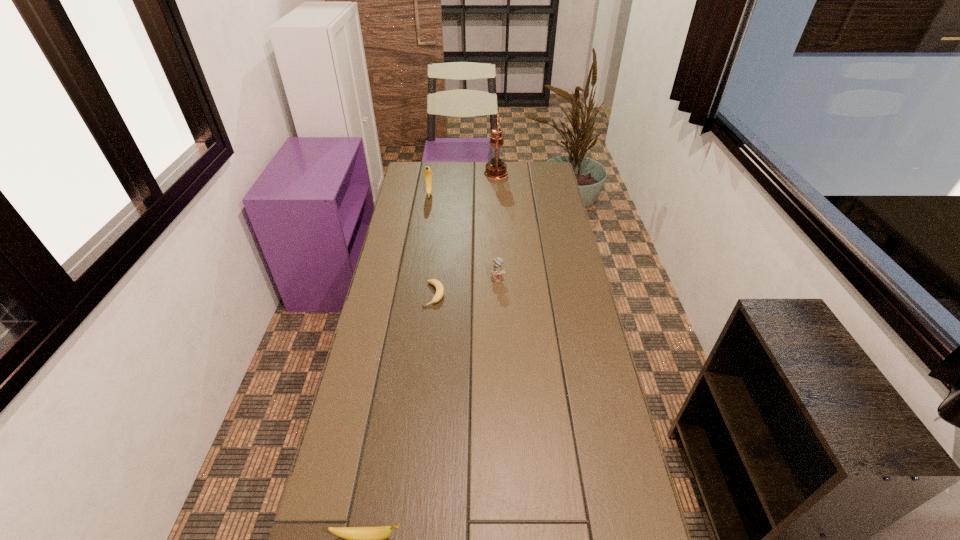
Locate an element on the screen. Image resolution: width=960 pixels, height=540 pixels. vacant area between the oil lamp and the third shortest object is located at coordinates (497, 226).

At what (x,y) coordinates should I click in order to perform the action: click on free point between the oil lamp and the fourth nearest object. Please return your answer as a coordinate pair (x, y). Image resolution: width=960 pixels, height=540 pixels. Looking at the image, I should click on (463, 184).

Find the location of a particular element. object that stands as the closest to the teddy bear is located at coordinates (437, 284).

Find the location of a particular element. object that is the third closest one to the second tallest banana is located at coordinates (427, 172).

In order to click on banana that is the closest to the second nearest banana in this screenshot , I will do `click(427, 172)`.

Identify which banana is the closest to the tallest banana. Please provide its 2D coordinates. Your answer should be formatted as a tuple, i.e. [(x, y)], where the tuple contains the x and y coordinates of a point satisfying the conditions above.

[(437, 284)]